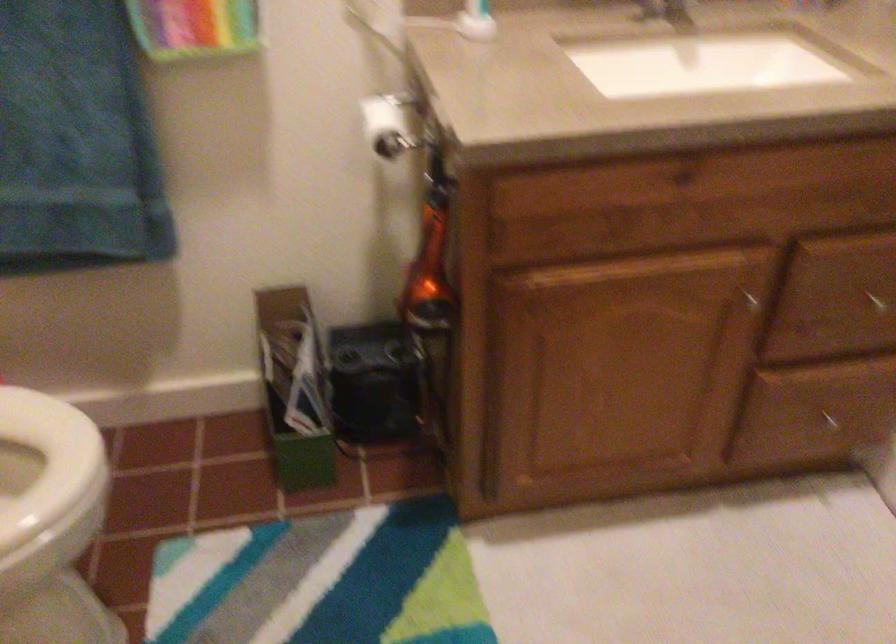
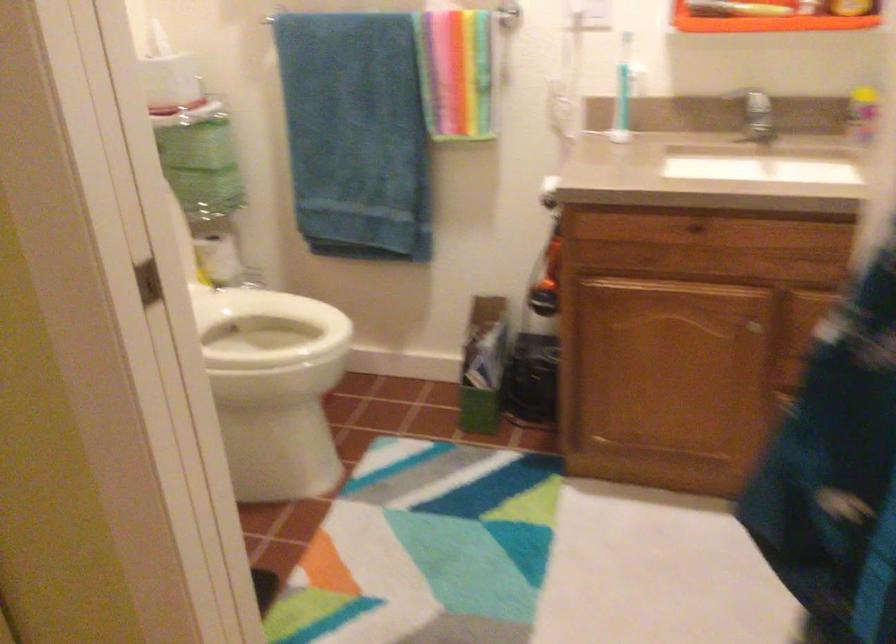
Question: I am providing you with two images of the same scene from different viewpoints. Please identify which objects are invisible in image2.

Choices:
 (A) silver faucet handle
 (B) cabinet drawer knob
 (C) toilet paper roll
 (D) donut-shaped pillow

Answer: (C)